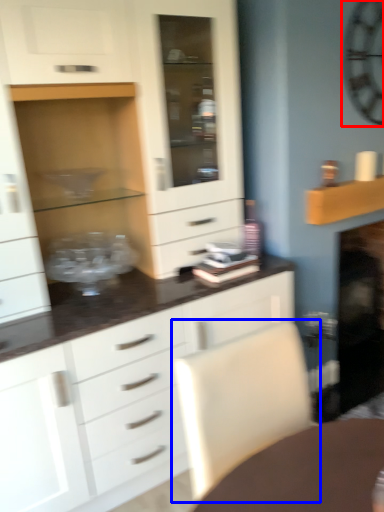
Question: Which object appears farthest to the camera in this image, clock (highlighted by a red box) or swivel chair (highlighted by a blue box)?

Choices:
 (A) clock
 (B) swivel chair

Answer: (A)